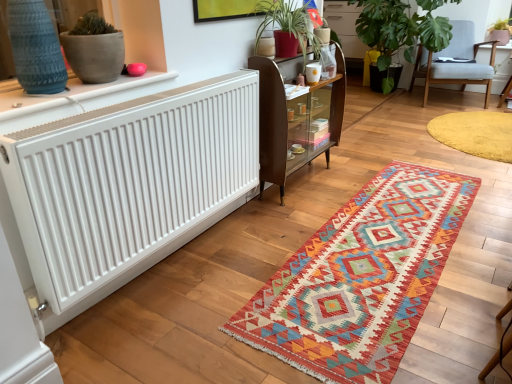
At what (x,y) coordinates should I click in order to perform the action: click on vacant area situated below knitted woolen rug at center, which ranks as the first mat in front-to-back order (from a real-world perspective). Please return your answer as a coordinate pair (x, y). The height and width of the screenshot is (384, 512). Looking at the image, I should click on (389, 239).